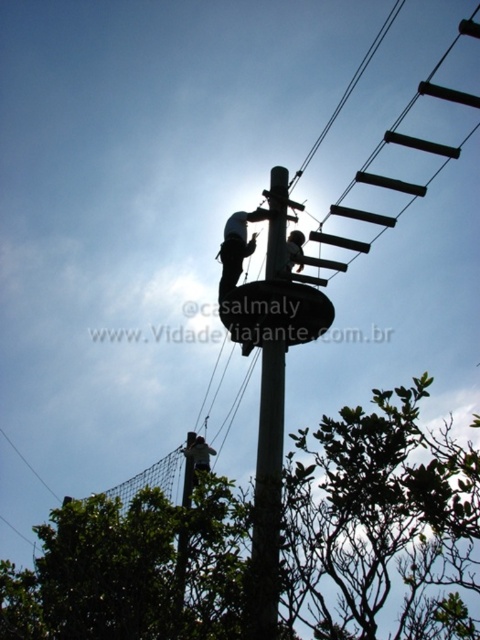
Question: Does black plastic sign at center appear under green fabric harness at center?

Choices:
 (A) yes
 (B) no

Answer: (B)

Question: Which point is closer to the camera?

Choices:
 (A) (460, 512)
 (B) (243, 353)
 (C) (202, 468)
 (D) (262, 410)

Answer: (A)

Question: Does green leafy tree at lower left appear under smooth wood telegraph pole at center?

Choices:
 (A) no
 (B) yes

Answer: (B)

Question: Can you confirm if smooth wood telegraph pole at center is positioned below black plastic sign at center?

Choices:
 (A) no
 (B) yes

Answer: (B)

Question: Which of the following is the farthest from the observer?

Choices:
 (A) green leafy tree at lower left
 (B) smooth wood telegraph pole at center

Answer: (A)

Question: Estimate the real-world distances between objects in this image. Which object is closer to the smooth wood telegraph pole at center?

Choices:
 (A) black plastic sign at center
 (B) green leafy tree at lower left
 (C) green fabric harness at center

Answer: (A)